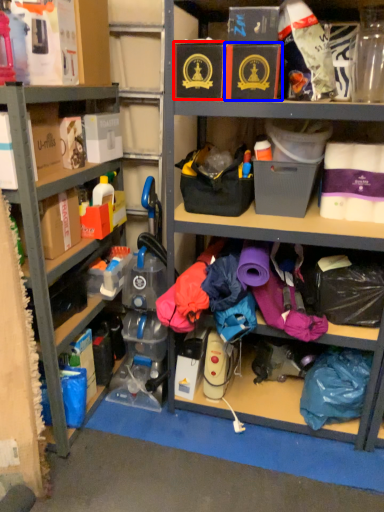
Question: Which of the following is the farthest to the observer, storage box (highlighted by a red box) or storage box (highlighted by a blue box)?

Choices:
 (A) storage box
 (B) storage box

Answer: (A)